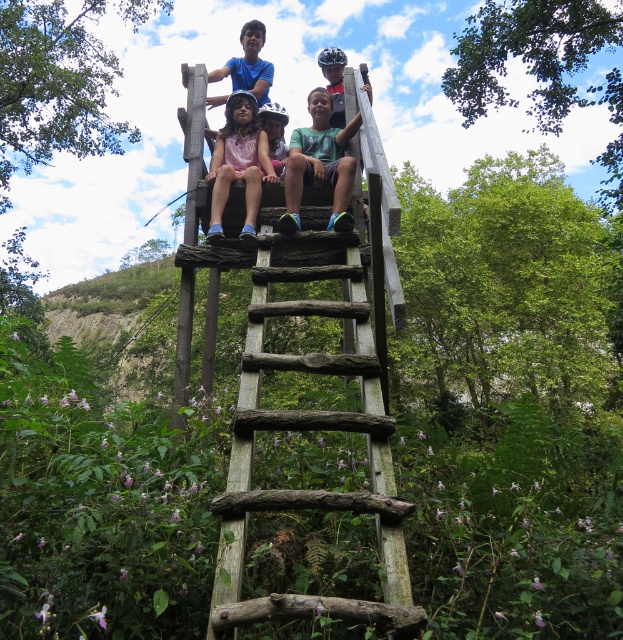
You are a parent trying to locate your child wearing a pink fabric dress at center in a forest. You see a weathered wood ladder at center. Based on the scene, can you determine if the ladder is blocking the view of the child?

The weathered wood ladder at center is in front of the pink fabric dress at center, so the ladder is blocking the view of the child wearing the pink fabric dress at center.